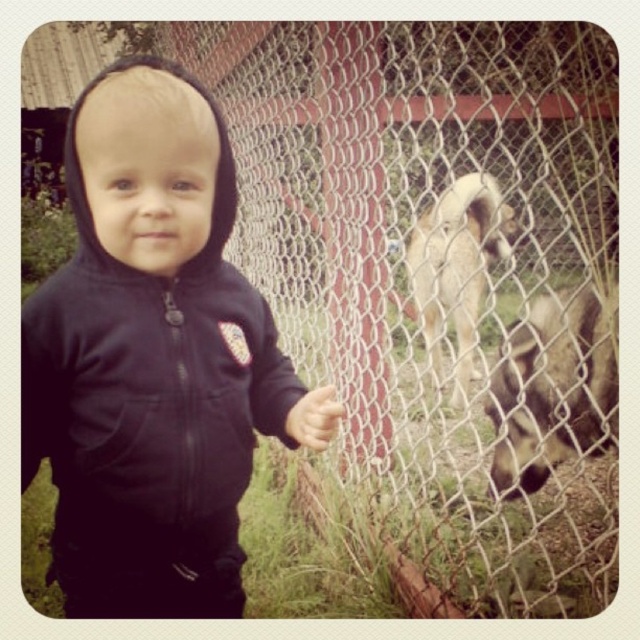
Measure the distance between black fleece hoodie at center and fuzzy brown fur at right.

black fleece hoodie at center is 35.33 inches from fuzzy brown fur at right.

Can you confirm if black fleece hoodie at center is thinner than fuzzy brown fur at right?

Yes, black fleece hoodie at center is thinner than fuzzy brown fur at right.

Is point (166, 550) in front of point (500, 484)?

Yes, it is in front of point (500, 484).

Where is `black fleece hoodie at center`? Image resolution: width=640 pixels, height=640 pixels. black fleece hoodie at center is located at coordinates (152, 358).

Between fuzzy brown fur at right and fuzzy beige dog at center, which one has less height?

Standing shorter between the two is fuzzy brown fur at right.

Is fuzzy brown fur at right positioned at the back of fuzzy beige dog at center?

No.

Measure the distance between point (525, 374) and camera.

A distance of 2.13 meters exists between point (525, 374) and camera.

You are a GUI agent. You are given a task and a screenshot of the screen. Output one action in this format:
    pyautogui.click(x=<x>, y=<y>)
    Task: Click on the fuzzy brown fur at right
    The width and height of the screenshot is (640, 640).
    Given the screenshot: What is the action you would take?
    pyautogui.click(x=554, y=387)

Can you confirm if black fleece hoodie at center is smaller than fuzzy beige dog at center?

Yes, black fleece hoodie at center is smaller than fuzzy beige dog at center.

The image size is (640, 640). Find the location of `black fleece hoodie at center`. black fleece hoodie at center is located at coordinates (152, 358).

Image resolution: width=640 pixels, height=640 pixels. Describe the element at coordinates (152, 358) in the screenshot. I see `black fleece hoodie at center` at that location.

The width and height of the screenshot is (640, 640). I want to click on black fleece hoodie at center, so click(152, 358).